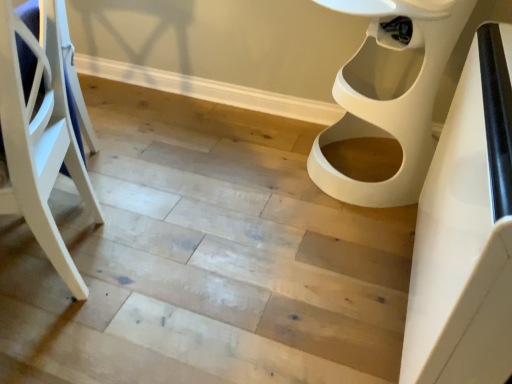
Question: Is white glossy table at right in contact with white wood chair at left?

Choices:
 (A) no
 (B) yes

Answer: (A)

Question: Is white glossy table at right not close to white wood chair at left?

Choices:
 (A) no
 (B) yes

Answer: (A)

Question: Does white glossy table at right have a lesser height compared to white wood chair at left?

Choices:
 (A) yes
 (B) no

Answer: (A)

Question: Is white glossy table at right taller than white wood chair at left?

Choices:
 (A) yes
 (B) no

Answer: (B)

Question: Considering the relative sizes of white glossy table at right and white wood chair at left in the image provided, is white glossy table at right bigger than white wood chair at left?

Choices:
 (A) no
 (B) yes

Answer: (A)

Question: Is white glossy table at right completely or partially outside of white wood chair at left?

Choices:
 (A) no
 (B) yes

Answer: (B)

Question: Does white plastic toilet at right have a smaller size compared to white wood chair at left?

Choices:
 (A) yes
 (B) no

Answer: (B)

Question: Would you say white plastic toilet at right is a long distance from white wood chair at left?

Choices:
 (A) no
 (B) yes

Answer: (A)

Question: Is white plastic toilet at right positioned in front of white wood chair at left?

Choices:
 (A) yes
 (B) no

Answer: (B)

Question: Can we say white plastic toilet at right lies outside white wood chair at left?

Choices:
 (A) no
 (B) yes

Answer: (B)

Question: Does white plastic toilet at right have a greater width compared to white wood chair at left?

Choices:
 (A) no
 (B) yes

Answer: (B)

Question: From a real-world perspective, does white plastic toilet at right stand above white wood chair at left?

Choices:
 (A) no
 (B) yes

Answer: (A)

Question: Is white glossy table at right facing towards white plastic toilet at right?

Choices:
 (A) yes
 (B) no

Answer: (B)